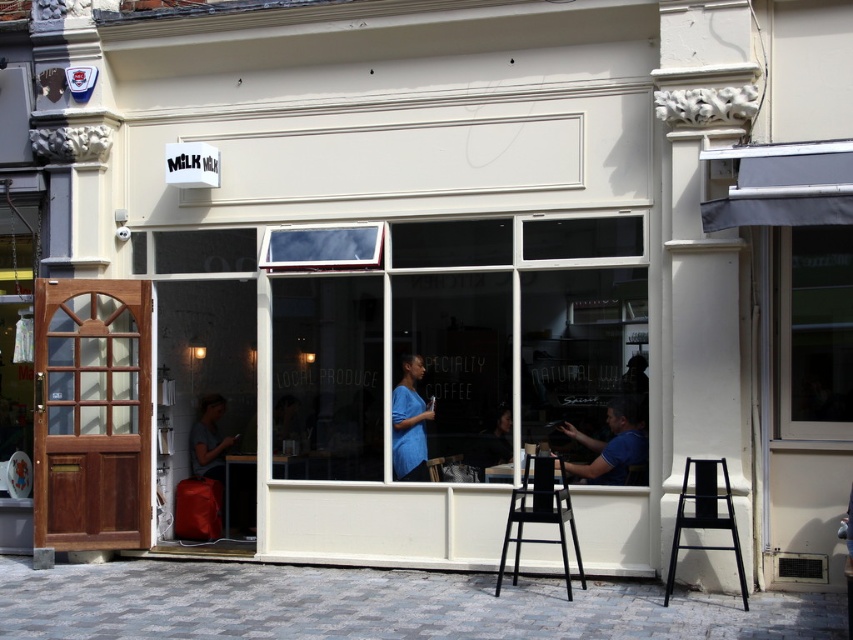
Question: Is black matte bar stool at lower right bigger than blue matte shirt at center?

Choices:
 (A) no
 (B) yes

Answer: (B)

Question: Which point is farther to the camera?

Choices:
 (A) [x=833, y=272]
 (B) [x=210, y=408]
 (C) [x=592, y=442]

Answer: (B)

Question: Does black plastic bar stool at center have a lesser width compared to black matte bar stool at lower right?

Choices:
 (A) no
 (B) yes

Answer: (A)

Question: Which of these objects is positioned farthest from the transparent glass window at center?

Choices:
 (A) blue matte shirt at center
 (B) matte red bag at lower left
 (C) blue cotton shirt at center
 (D) black plastic bar stool at center

Answer: (B)

Question: Is black matte bar stool at lower right to the left of blue cotton shirt at center from the viewer's perspective?

Choices:
 (A) no
 (B) yes

Answer: (A)

Question: Which object appears closest to the camera in this image?

Choices:
 (A) blue matte shirt at center
 (B) black plastic bar stool at center

Answer: (B)